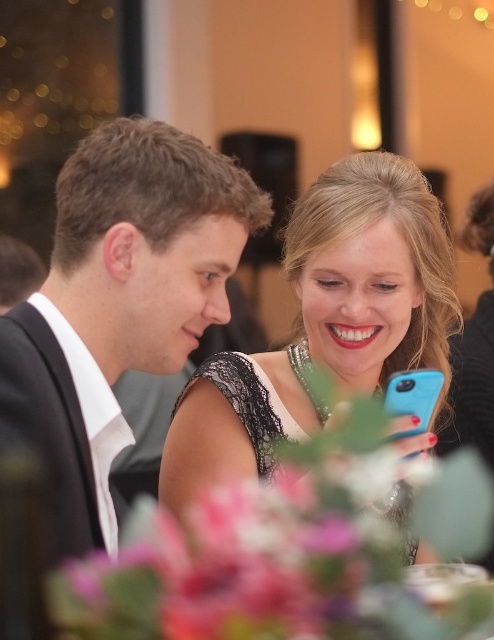
Question: Does black satin suit at left have a larger size compared to matte black dress at center?

Choices:
 (A) yes
 (B) no

Answer: (B)

Question: Is black satin suit at left further to camera compared to matte black dress at center?

Choices:
 (A) yes
 (B) no

Answer: (B)

Question: Is black satin suit at left wider than matte black dress at center?

Choices:
 (A) no
 (B) yes

Answer: (A)

Question: Which point appears farthest from the camera in this image?

Choices:
 (A) (239, 381)
 (B) (123, 211)

Answer: (A)

Question: Which object is farther from the camera taking this photo?

Choices:
 (A) black satin suit at left
 (B) matte black dress at center

Answer: (B)